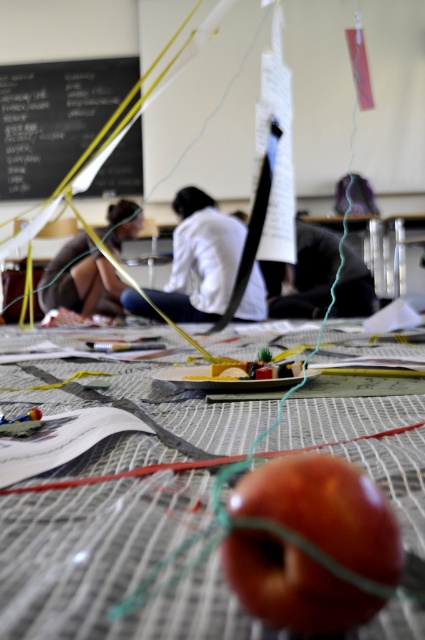
Question: Which object appears farthest from the camera in this image?

Choices:
 (A) shiny metallic apple at center
 (B) black chalkboard at upper left

Answer: (B)

Question: Can you confirm if shiny metallic apple at center is positioned above matte brown hair at center?

Choices:
 (A) yes
 (B) no

Answer: (B)

Question: Does white matte shirt at center have a smaller size compared to matte brown hair at center?

Choices:
 (A) yes
 (B) no

Answer: (B)

Question: Which of the following is the closest to the observer?

Choices:
 (A) (130, 486)
 (B) (59, 80)
 (C) (187, 189)

Answer: (A)

Question: Does black chalkboard at upper left appear under matte brown hair at center?

Choices:
 (A) no
 (B) yes

Answer: (A)

Question: Which point is closer to the camera?

Choices:
 (A) matte brown hair at center
 (B) shiny metallic apple at center

Answer: (B)